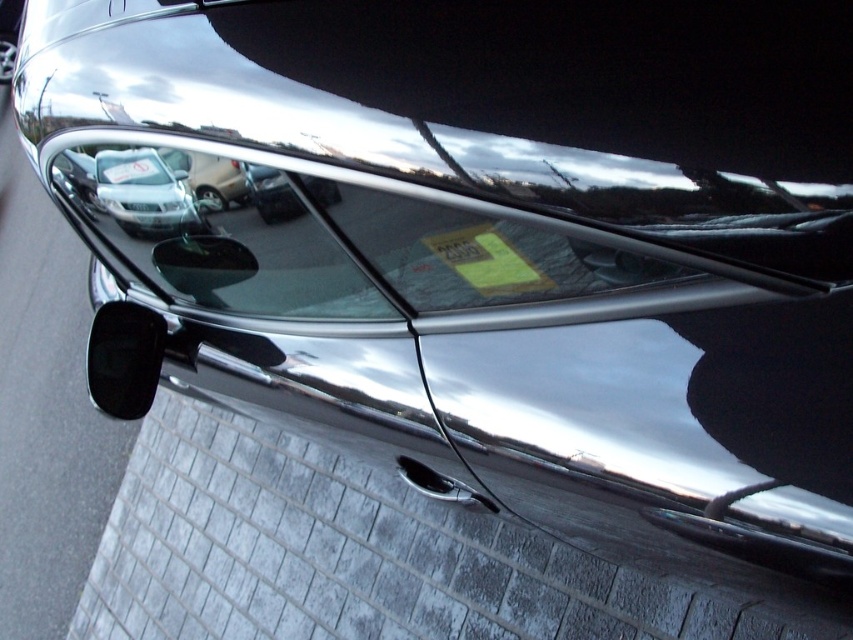
Looking at this image, you are standing in a parking lot and want to check if you can reach the clear glass window at center of a car without touching the car door. The car door is 5 feet away from you. Can you reach the window if your arm can extend 2.5 feet?

The clear glass window at center is 3.46 feet away from the camera. Since the car door is 5 feet away from you and your arm can extend 2.5 feet, the total distance you can reach is 2.5 feet. However, the window is 3.46 feet away, so you cannot reach it without touching the car door.

Based on the scene description, where is the clear glass window at center located in the image?

The clear glass window at center is located at point coordinates of 0.362 in the x axis and 0.254 in the y axis.

You are a delivery person trying to attach a package label to either the clear glass window at center or the white plastic license plate at center. Which surface would allow the label to be seen more clearly from the front of the car?

The clear glass window at center would allow the label to be seen more clearly from the front of the car since it is wider than the white plastic license plate at center and offers a transparent surface for visibility.